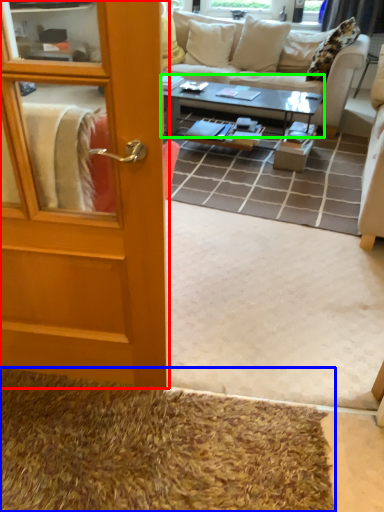
Question: Which object is positioned farthest from door (highlighted by a red box)? Select from doormat (highlighted by a blue box) and coffee table (highlighted by a green box).

Choices:
 (A) doormat
 (B) coffee table

Answer: (B)